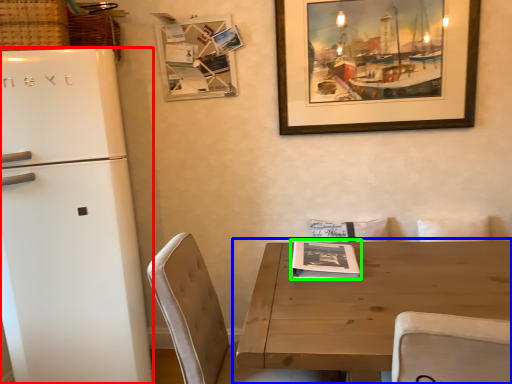
Question: Estimate the real-world distances between objects in this image. Which object is closer to refrigerator (highlighted by a red box), table (highlighted by a blue box) or magazine (highlighted by a green box)?

Choices:
 (A) table
 (B) magazine

Answer: (B)